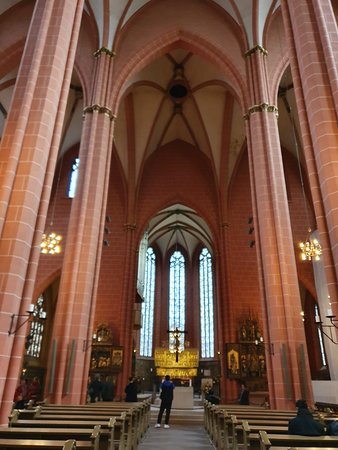
Identify the location of salmon striped pillars. (7, 269), (80, 289), (284, 299), (334, 261).